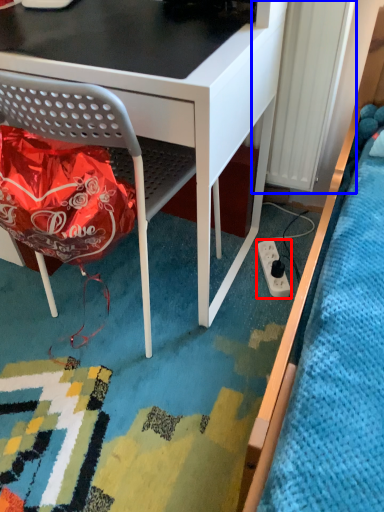
Question: Which object appears farthest to the camera in this image, power plugs and sockets (highlighted by a red box) or radiator (highlighted by a blue box)?

Choices:
 (A) power plugs and sockets
 (B) radiator

Answer: (A)